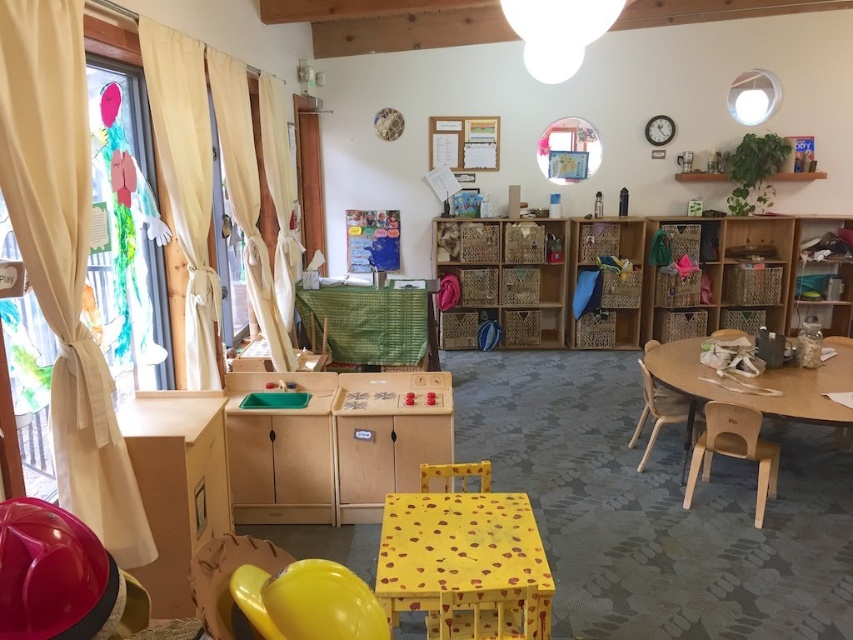
Question: Can you confirm if woven wood bookshelf at center is bigger than wooden table at right?

Choices:
 (A) yes
 (B) no

Answer: (A)

Question: Is woven basket at center further to camera compared to green fabric-covered table at center?

Choices:
 (A) no
 (B) yes

Answer: (B)

Question: In this image, where is woven basket at center located relative to green fabric-covered table at center?

Choices:
 (A) above
 (B) below

Answer: (A)

Question: Among these objects, which one is farthest from the camera?

Choices:
 (A) green fabric-covered table at center
 (B) wooden chair at center
 (C) yellow painted wood table at center

Answer: (A)

Question: Which object is farther from the camera taking this photo?

Choices:
 (A) yellow painted wood table at center
 (B) woven basket at center
 (C) wooden chair at right
 (D) yellow plastic chair at lower center

Answer: (B)

Question: Which point appears closest to the camera in this image?

Choices:
 (A) click(x=764, y=440)
 (B) click(x=544, y=314)
 (C) click(x=316, y=579)

Answer: (C)